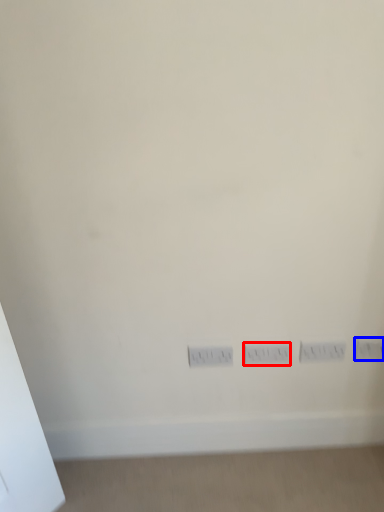
Question: Which point is closer to the camera, switch (highlighted by a red box) or electric outlet (highlighted by a blue box)?

Choices:
 (A) switch
 (B) electric outlet

Answer: (A)